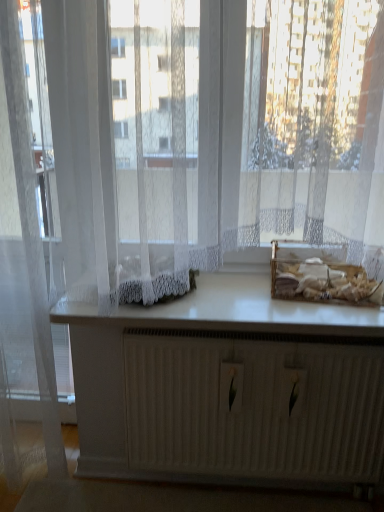
This screenshot has width=384, height=512. In order to click on vacant region in front of translucent plastic basket at center in this screenshot , I will do `click(331, 313)`.